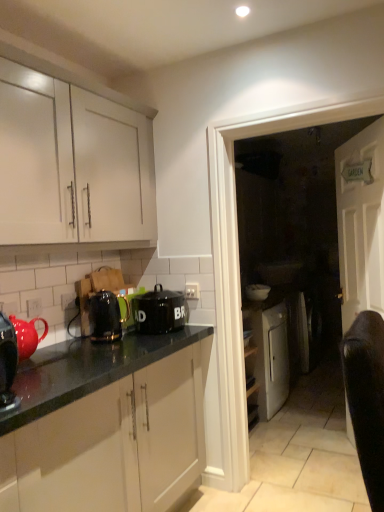
Question: Could you tell me if white matte cabinet at upper left is turned towards metallic black toaster at center-left, the second kitchen appliance from the right?

Choices:
 (A) no
 (B) yes

Answer: (A)

Question: Can you confirm if white matte cabinet at upper left is positioned to the left of metallic black toaster at center-left, the second kitchen appliance from the right?

Choices:
 (A) yes
 (B) no

Answer: (A)

Question: Is white matte cabinet at upper left wider than metallic black toaster at center-left, the second kitchen appliance from the right?

Choices:
 (A) yes
 (B) no

Answer: (A)

Question: From a real-world perspective, does white matte cabinet at upper left sit lower than metallic black toaster at center-left, which appears as the second kitchen appliance when viewed from the front?

Choices:
 (A) yes
 (B) no

Answer: (B)

Question: Considering the relative sizes of white matte cabinet at upper left and metallic black toaster at center-left, which appears as the second kitchen appliance when viewed from the front, in the image provided, is white matte cabinet at upper left smaller than metallic black toaster at center-left, which appears as the second kitchen appliance when viewed from the front,?

Choices:
 (A) no
 (B) yes

Answer: (A)

Question: From their relative heights in the image, would you say shiny black kettle at left, the 3th kitchen appliance viewed from the back, is taller or shorter than white glossy door at center?

Choices:
 (A) short
 (B) tall

Answer: (A)

Question: Considering the positions of shiny black kettle at left, placed as the third kitchen appliance when sorted from right to left, and white glossy door at center in the image, is shiny black kettle at left, placed as the third kitchen appliance when sorted from right to left, bigger or smaller than white glossy door at center?

Choices:
 (A) small
 (B) big

Answer: (A)

Question: Is shiny black kettle at left, the 3th kitchen appliance viewed from the back, wider or thinner than white glossy door at center?

Choices:
 (A) thin
 (B) wide

Answer: (A)

Question: Is shiny black kettle at left, the 3th kitchen appliance viewed from the back, in front of or behind white glossy door at center in the image?

Choices:
 (A) front
 (B) behind

Answer: (A)

Question: Is matte ceramic teapot at left bigger or smaller than black ceramic canister at center, which is the third kitchen appliance in front-to-back order?

Choices:
 (A) big
 (B) small

Answer: (B)

Question: Is matte ceramic teapot at left spatially inside black ceramic canister at center, arranged as the 1th kitchen appliance when viewed from the back, or outside of it?

Choices:
 (A) outside
 (B) inside

Answer: (A)

Question: Considering the positions of matte ceramic teapot at left and black ceramic canister at center, arranged as the 1th kitchen appliance when viewed from the back, in the image, is matte ceramic teapot at left taller or shorter than black ceramic canister at center, arranged as the 1th kitchen appliance when viewed from the back,?

Choices:
 (A) tall
 (B) short

Answer: (B)

Question: Would you say matte ceramic teapot at left is to the left or to the right of black ceramic canister at center, the 3th kitchen appliance viewed from the left, in the picture?

Choices:
 (A) right
 (B) left

Answer: (B)

Question: Does point (8, 333) appear closer or farther from the camera than point (264, 289)?

Choices:
 (A) farther
 (B) closer

Answer: (B)

Question: Considering their positions, is shiny black kettle at left, placed as the third kitchen appliance when sorted from right to left, located in front of or behind white glossy bowl at center?

Choices:
 (A) front
 (B) behind

Answer: (A)